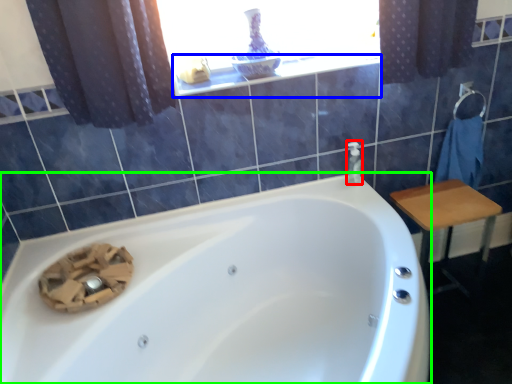
Question: Which is nearer to the soap dispenser (highlighted by a red box)? window sill (highlighted by a blue box) or bathtub (highlighted by a green box).

Choices:
 (A) window sill
 (B) bathtub

Answer: (A)